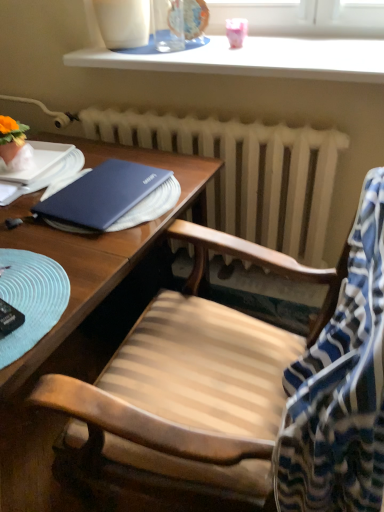
Question: Is wooden chair at center in front of or behind white glossy window sill at upper center in the image?

Choices:
 (A) behind
 (B) front

Answer: (B)

Question: Considering the positions of wooden chair at center and white glossy window sill at upper center in the image, is wooden chair at center taller or shorter than white glossy window sill at upper center?

Choices:
 (A) short
 (B) tall

Answer: (B)

Question: Which is farther from the white matte radiator at center?

Choices:
 (A) wooden chair at center
 (B) white glossy window sill at upper center
 (C) matte blue notebook at center
 (D) wooden desk at center
 (E) blue striped fabric at right

Answer: (E)

Question: Estimate the real-world distances between objects in this image. Which object is closer to the matte blue notebook at center?

Choices:
 (A) white matte radiator at center
 (B) wooden chair at center
 (C) blue striped fabric at right
 (D) wooden desk at center
 (E) white glossy window sill at upper center

Answer: (D)